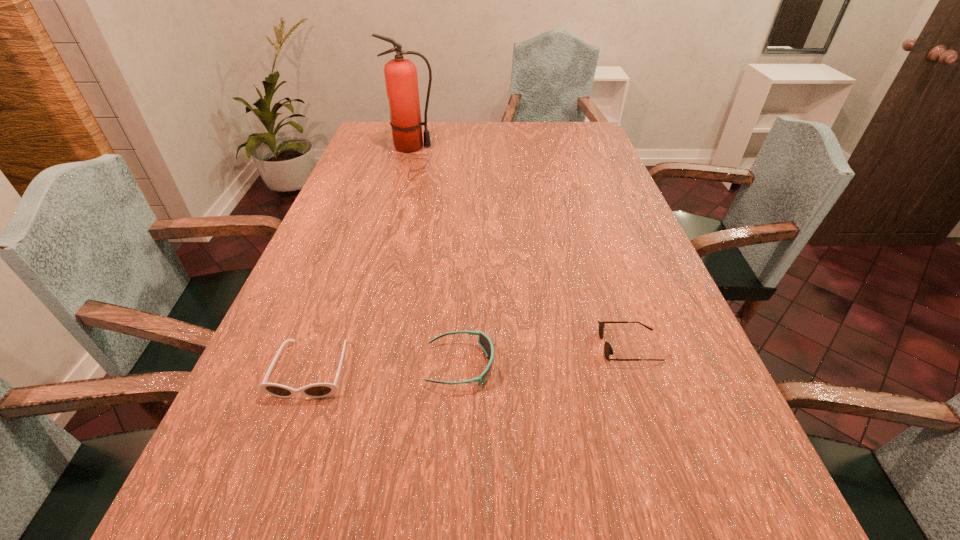
The width and height of the screenshot is (960, 540). What are the coordinates of `free space located on the front-facing side of the shortest sunglasses` in the screenshot? It's located at (405, 346).

Locate an element on the screen. The height and width of the screenshot is (540, 960). vacant region located 0.290m on the front-facing side of the shortest sunglasses is located at coordinates (459, 346).

Where is `object positioned at the far edge`? object positioned at the far edge is located at coordinates (401, 79).

The width and height of the screenshot is (960, 540). I want to click on fire extinguisher present at the left edge, so click(401, 79).

Locate an element on the screen. sunglasses that is at the left edge is located at coordinates (317, 390).

Find the location of a particular element. Image resolution: width=960 pixels, height=540 pixels. object present at the right edge is located at coordinates (608, 350).

Image resolution: width=960 pixels, height=540 pixels. Identify the location of object at the far left corner. (401, 79).

You are a GUI agent. You are given a task and a screenshot of the screen. Output one action in this format:
    pyautogui.click(x=<x>, y=<y>)
    Task: Click on the vacant position at the far edge of the desktop
    The width and height of the screenshot is (960, 540).
    Given the screenshot: What is the action you would take?
    pyautogui.click(x=446, y=139)

Identify the location of vacant space at the left edge. (320, 238).

Identify the location of free space at the right edge. (605, 231).